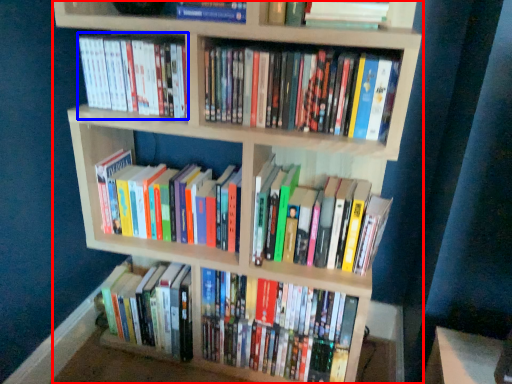
Question: Which of the following is the closest to the observer, bookcase (highlighted by a red box) or book (highlighted by a blue box)?

Choices:
 (A) bookcase
 (B) book

Answer: (A)